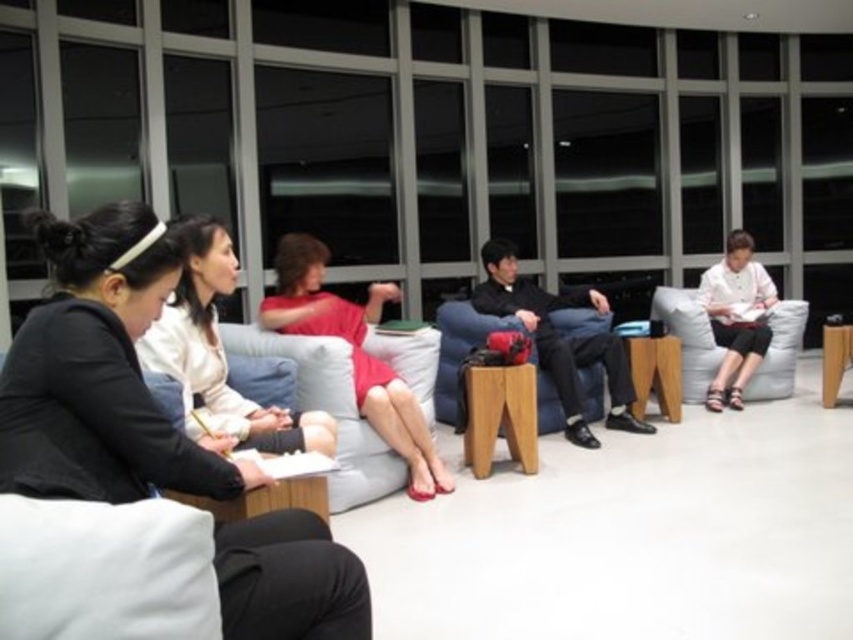
You are standing at the origin point in the room. Which object is located at the coordinates point (100, 372)?

The point (100, 372) marks the location of the matte black jacket at left.

Based on the photo, you are a photographer setting up a shoot in the lounge. You notice the matte black jacket at left and the white matte shirt at right. Which item should you adjust your camera focus on first if you want to ensure both are in focus, considering their positions?

The matte black jacket at left is below the white matte shirt at right, so you should focus on the white matte shirt at right first since it is higher up and closer to the camera.

You are standing at the entrance of the room and want to greet the person wearing the matte black jacket at left. Which direction should you walk to reach them?

Since the matte black jacket at left is located at point 0.583 on the x axis and 0.118 on the y axis, you should walk towards the left side of the room to reach them.